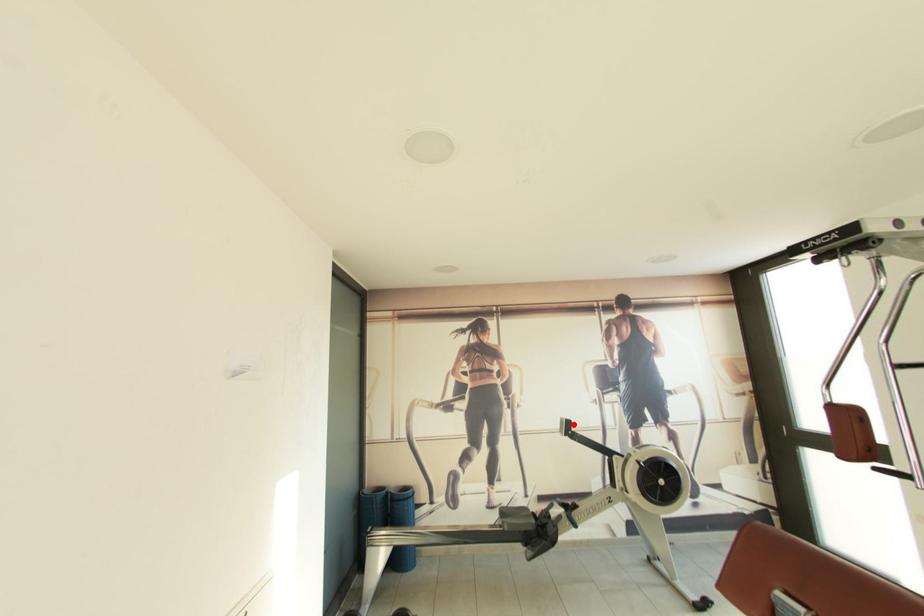
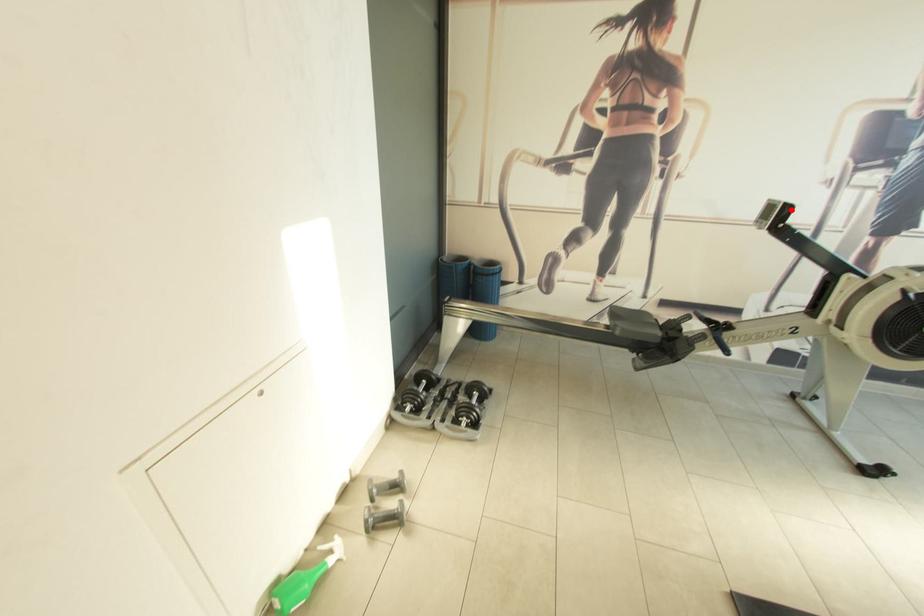
I am providing you with two images of the same scene from different viewpoints. A red point is marked on the first image and another point is marked on the second image. Is the red point in image1 aligned with the point shown in image2?

Yes